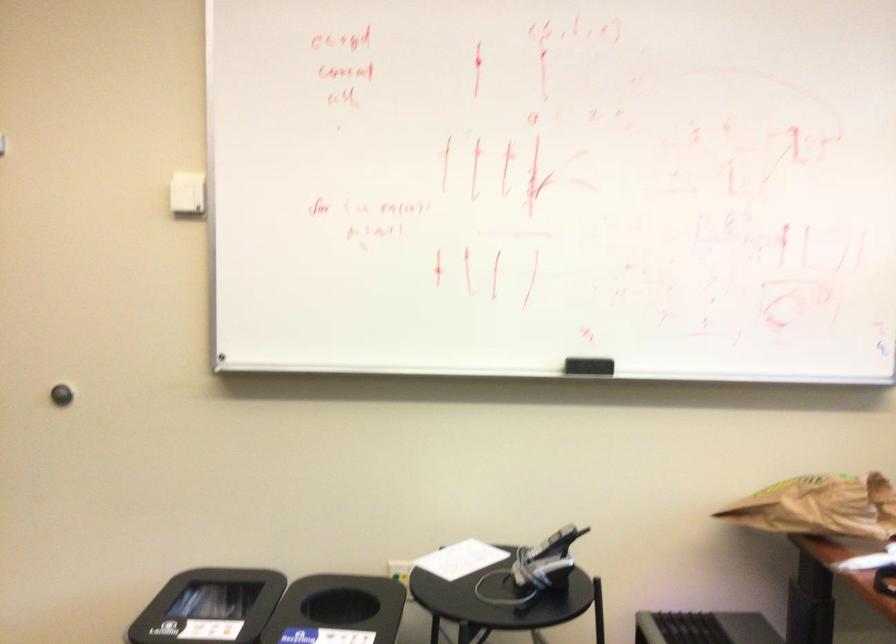
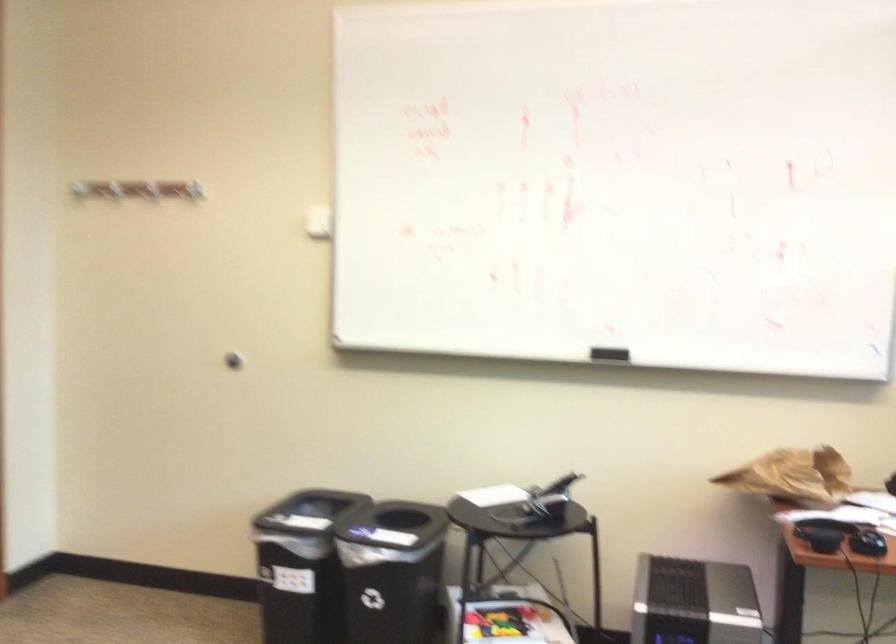
In the second image, find the point that corresponds to [529,565] in the first image.

(539, 503)